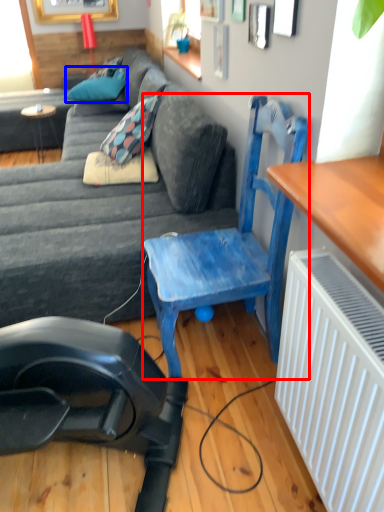
Question: Which object is further to the camera taking this photo, chair (highlighted by a red box) or pillow (highlighted by a blue box)?

Choices:
 (A) chair
 (B) pillow

Answer: (B)